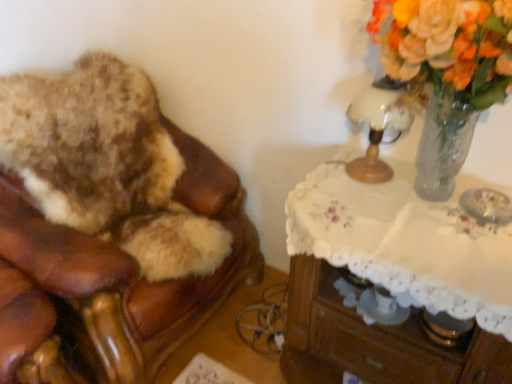
Image resolution: width=512 pixels, height=384 pixels. Find the location of `empty space that is ontop of white lace-covered table at upper right (from a real-world perspective)`. empty space that is ontop of white lace-covered table at upper right (from a real-world perspective) is located at coordinates (404, 216).